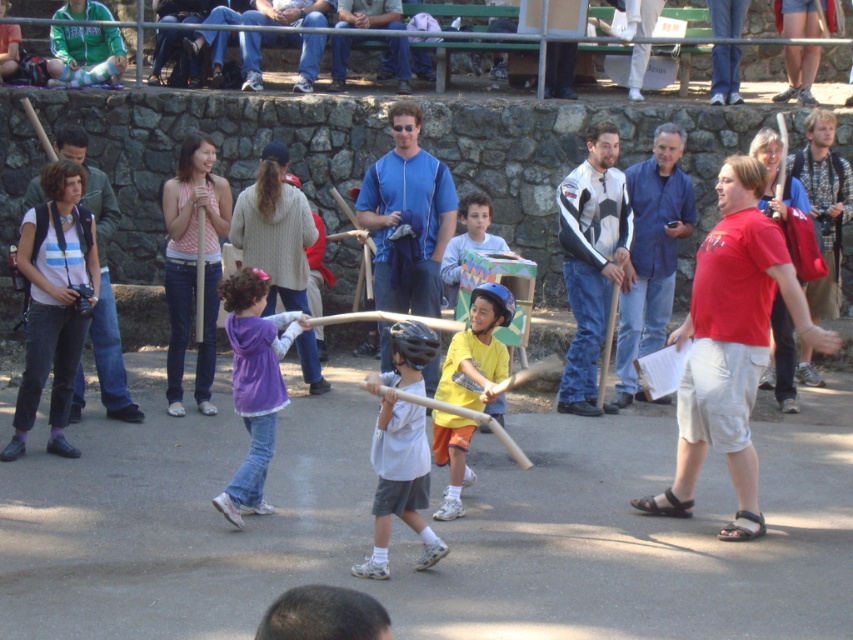
You are a photographer at the event and want to capture a photo that includes both the white matte baseball bat at center and the green fleece jacket at upper left. Which object should you focus on first to ensure both are in the frame?

The white matte baseball bat at center is below the green fleece jacket at upper left. To include both in the frame, focus on the green fleece jacket at upper left first, then adjust the camera downward to include the white matte baseball bat at center.

You are standing at the point with coordinates point (407, 218). What object are you standing on?

The point (407, 218) corresponds to the blue zip up jacket at center.